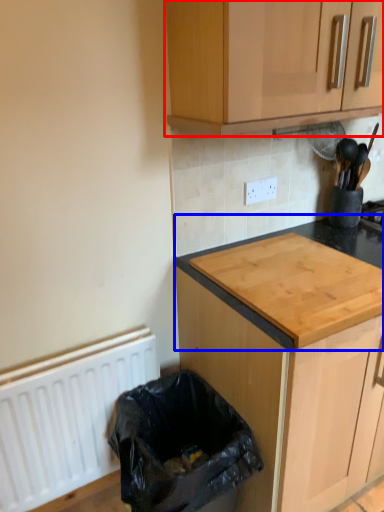
Question: Which object appears farthest to the camera in this image, cabinetry (highlighted by a red box) or countertop (highlighted by a blue box)?

Choices:
 (A) cabinetry
 (B) countertop

Answer: (B)